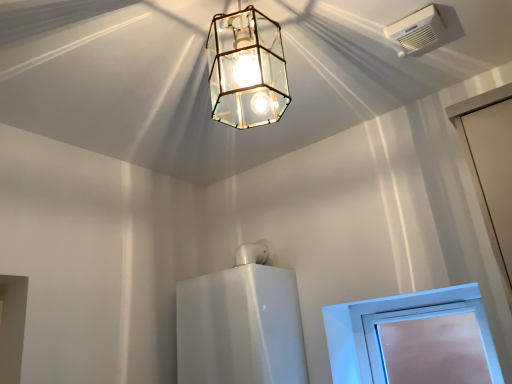
Question: Would you consider clear glass lantern at upper center to be distant from white glossy water heater at center?

Choices:
 (A) yes
 (B) no

Answer: (B)

Question: Is clear glass lantern at upper center oriented towards white glossy water heater at center?

Choices:
 (A) yes
 (B) no

Answer: (B)

Question: Is clear glass lantern at upper center completely or partially outside of white glossy water heater at center?

Choices:
 (A) no
 (B) yes

Answer: (B)

Question: Does clear glass lantern at upper center have a larger size compared to white glossy water heater at center?

Choices:
 (A) yes
 (B) no

Answer: (B)

Question: Considering the relative positions of clear glass lantern at upper center and white glossy water heater at center in the image provided, is clear glass lantern at upper center to the right of white glossy water heater at center from the viewer's perspective?

Choices:
 (A) yes
 (B) no

Answer: (A)

Question: Does clear glass lantern at upper center touch white glossy water heater at center?

Choices:
 (A) no
 (B) yes

Answer: (A)

Question: Considering the relative positions of white plastic air conditioning unit at upper right and clear glass lantern at upper center in the image provided, is white plastic air conditioning unit at upper right to the left of clear glass lantern at upper center from the viewer's perspective?

Choices:
 (A) no
 (B) yes

Answer: (A)

Question: Is white plastic air conditioning unit at upper right aimed at clear glass lantern at upper center?

Choices:
 (A) no
 (B) yes

Answer: (A)

Question: Considering the relative sizes of white plastic air conditioning unit at upper right and clear glass lantern at upper center in the image provided, is white plastic air conditioning unit at upper right thinner than clear glass lantern at upper center?

Choices:
 (A) no
 (B) yes

Answer: (B)

Question: Does white plastic air conditioning unit at upper right have a greater width compared to clear glass lantern at upper center?

Choices:
 (A) no
 (B) yes

Answer: (A)

Question: Is white plastic air conditioning unit at upper right far away from clear glass lantern at upper center?

Choices:
 (A) no
 (B) yes

Answer: (A)

Question: Is white plastic air conditioning unit at upper right behind clear glass lantern at upper center?

Choices:
 (A) no
 (B) yes

Answer: (B)

Question: Is white plastic window at lower right positioned with its back to clear glass lantern at upper center?

Choices:
 (A) yes
 (B) no

Answer: (B)